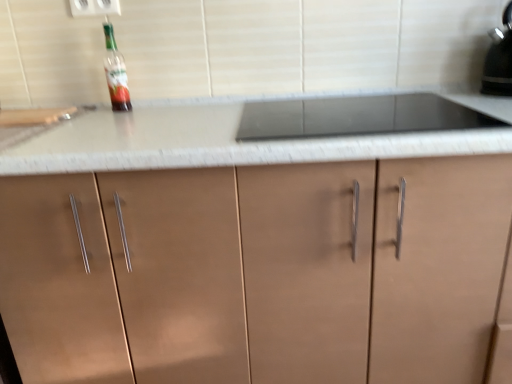
Identify the location of free location in front of translucent glass bottle at upper left. The height and width of the screenshot is (384, 512). (105, 118).